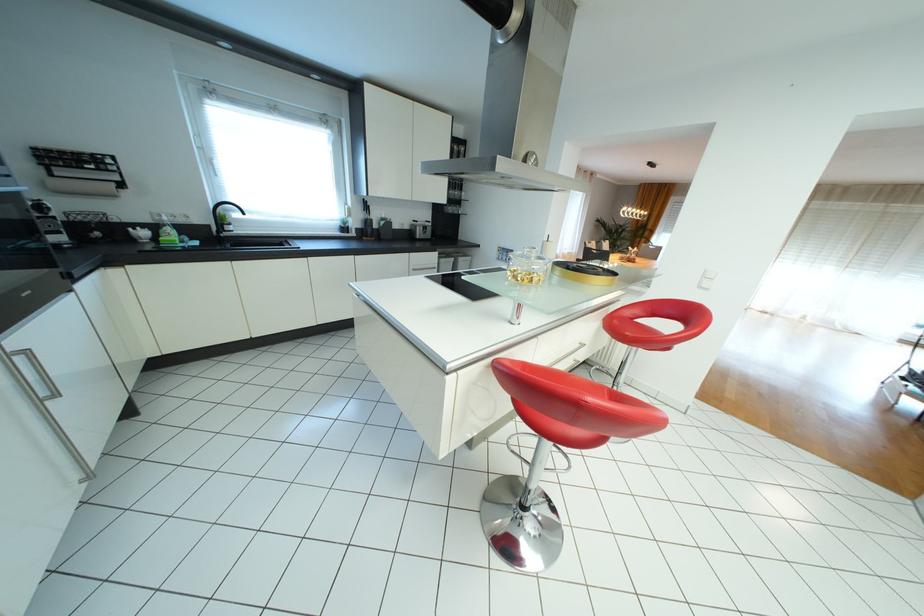
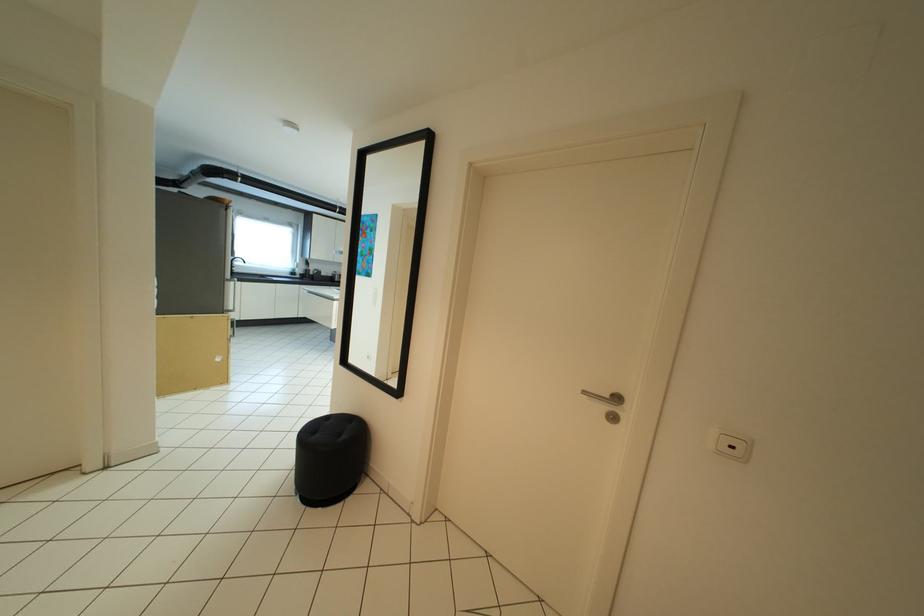
Question: What movement of the cameraman would produce the second image?

Choices:
 (A) Left
 (B) Right
 (C) Forward
 (D) Backward

Answer: (D)